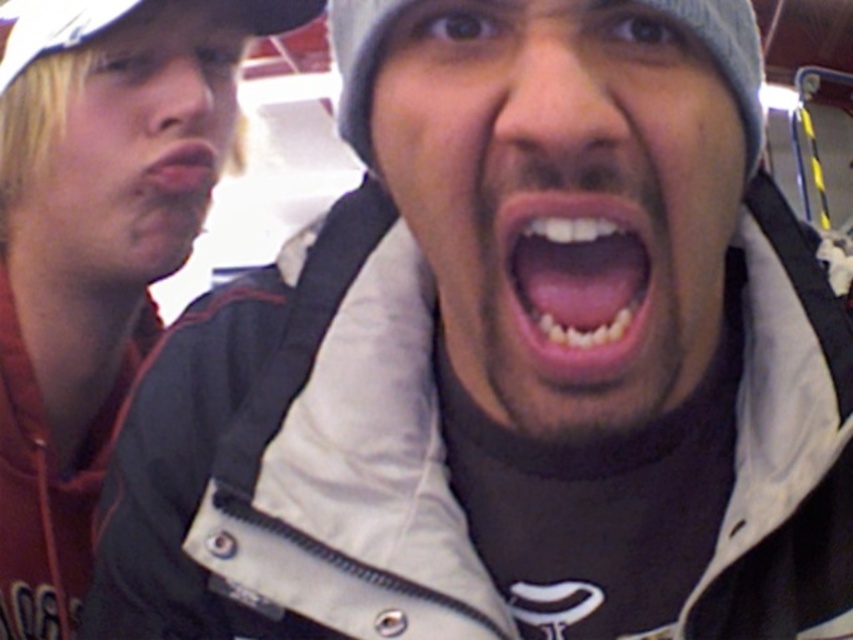
Based on the scene described, which object, the matte black jacket at left or the blonde hair at left, occupies a larger vertical space in the image?

The matte black jacket at left has a greater height compared to the blonde hair at left, so it occupies a larger vertical space in the image.

Based on the scene description, which object is positioned lower in the image between the matte black jacket at left and the blonde hair at left?

The matte black jacket at left is positioned below the blonde hair at left, so it is lower in the image.